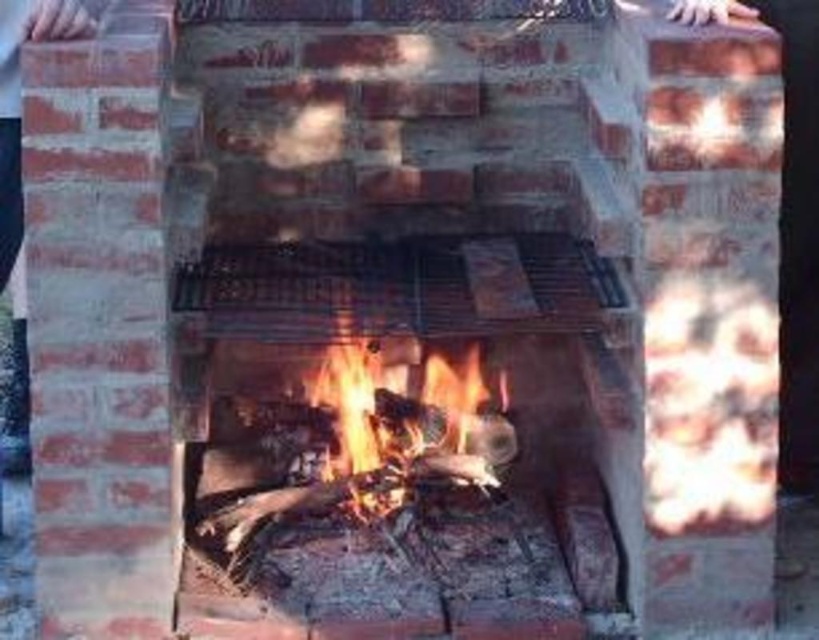
Is point (500, 252) positioned after point (405, 406)?

No, it is in front of (405, 406).

Between black metal grill at center and flaming wood at center, which one appears on the right side from the viewer's perspective?

Positioned to the right is flaming wood at center.

Who is more forward, (279, 248) or (412, 406)?

Point (279, 248) is in front.

This screenshot has height=640, width=819. I want to click on black metal grill at center, so click(400, 288).